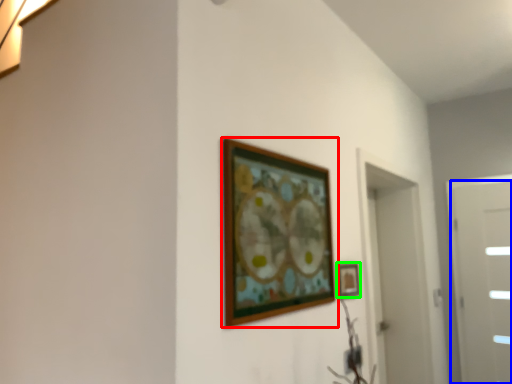
Question: Estimate the real-world distances between objects in this image. Which object is farther from picture frame (highlighted by a red box), door (highlighted by a blue box) or picture frame (highlighted by a green box)?

Choices:
 (A) door
 (B) picture frame

Answer: (A)